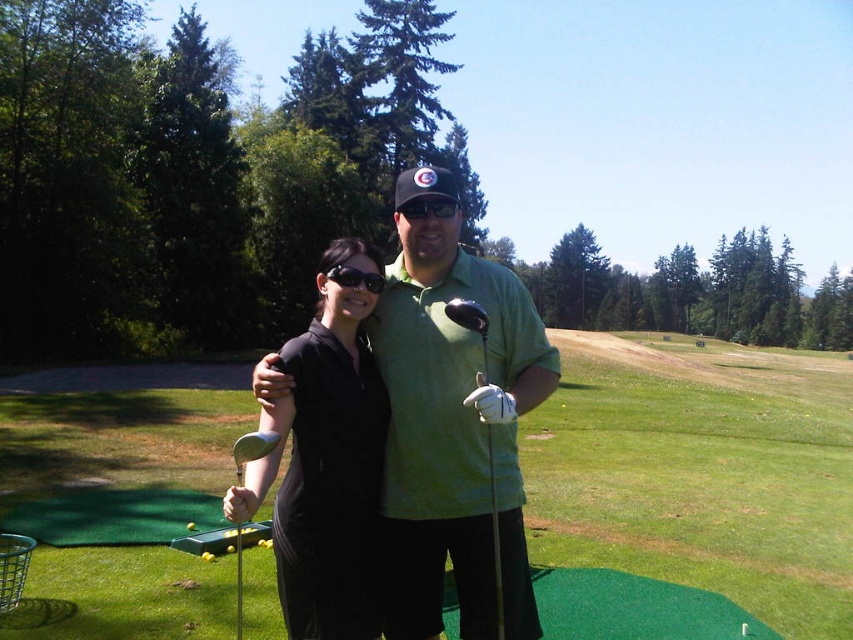
Between point (463, 248) and point (471, 324), which one is positioned in front?

Positioned in front is point (471, 324).

Who is taller, green matte golf shirt at center or shiny black metal golf club at center?

shiny black metal golf club at center

Describe the element at coordinates (454, 426) in the screenshot. The height and width of the screenshot is (640, 853). I see `green matte golf shirt at center` at that location.

You are a GUI agent. You are given a task and a screenshot of the screen. Output one action in this format:
    pyautogui.click(x=<x>, y=<y>)
    Task: Click on the green matte golf shirt at center
    Image resolution: width=853 pixels, height=640 pixels.
    Given the screenshot: What is the action you would take?
    pyautogui.click(x=454, y=426)

Is shiny black metal golf club at center to the right of yellow matte golf ball at center from the viewer's perspective?

Yes, shiny black metal golf club at center is to the right of yellow matte golf ball at center.

At what (x,y) coordinates should I click in order to perform the action: click on shiny black metal golf club at center. Please return your answer as a coordinate pair (x, y). The height and width of the screenshot is (640, 853). Looking at the image, I should click on (471, 330).

Describe the element at coordinates (471, 330) in the screenshot. I see `shiny black metal golf club at center` at that location.

Where is `shiny black metal golf club at center`? shiny black metal golf club at center is located at coordinates (471, 330).

Does shiny black metal golf club at center appear on the right side of black matte cap at center?

Correct, you'll find shiny black metal golf club at center to the right of black matte cap at center.

Which is behind, point (498, 570) or point (445, 214)?

The point (445, 214) is behind.

Locate an element on the screen. The image size is (853, 640). shiny black metal golf club at center is located at coordinates (471, 330).